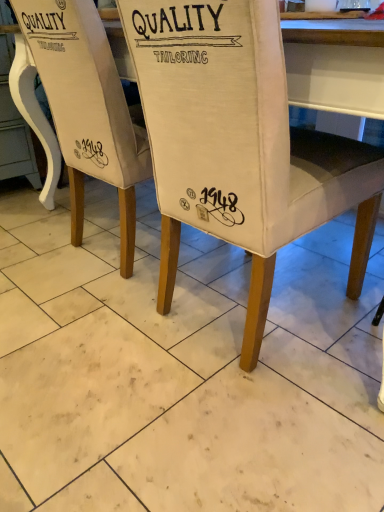
At what (x,y) coordinates should I click in order to perform the action: click on vacant area that lies between white fabric chair at center, which is the first chair in right-to-left order, and canvas chair at center, arranged as the second chair when viewed from the right. Please return your answer as a coordinate pair (x, y). The width and height of the screenshot is (384, 512). Looking at the image, I should click on (154, 282).